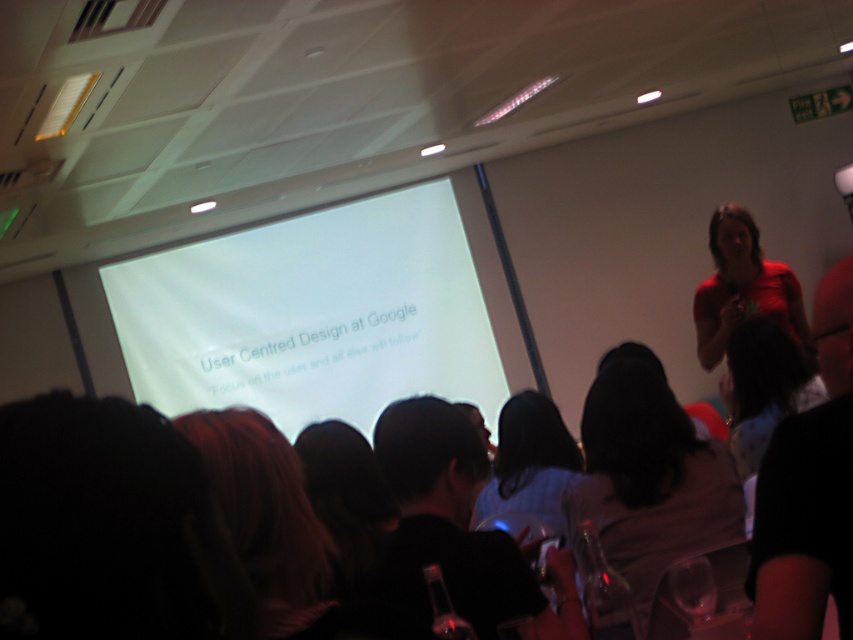
Is the position of silky black hair at center more distant than that of red matte shirt at upper right?

No, it is not.

From the picture: Who is positioned more to the left, silky black hair at center or red matte shirt at upper right?

silky black hair at center

Who is more forward, (734,472) or (721,387)?

Point (734,472) is more forward.

Image resolution: width=853 pixels, height=640 pixels. I want to click on silky black hair at center, so click(650, 480).

Does white matte projection screen at center have a lesser height compared to transparent plastic wine glass at lower right?

No.

How far apart are white matte projection screen at center and transparent plastic wine glass at lower right?

A distance of 5.11 meters exists between white matte projection screen at center and transparent plastic wine glass at lower right.

Between point (297, 332) and point (701, 596), which one is positioned behind?

Positioned behind is point (297, 332).

Find the location of a particular element. The image size is (853, 640). white matte projection screen at center is located at coordinates point(312,316).

Between point (236, 429) and point (737, 208), which one is positioned in front?

Point (236, 429)

Does point (308, 593) come behind point (758, 289)?

No, (308, 593) is closer to viewer.

Locate an element on the screen. The height and width of the screenshot is (640, 853). dark brown hair at lower left is located at coordinates (267, 516).